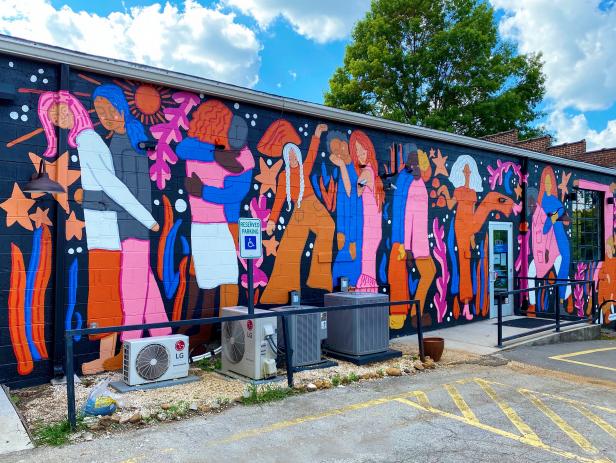
Where is `door`? door is located at coordinates (499, 247).